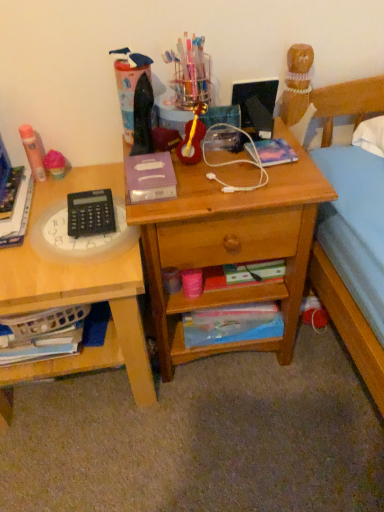
The height and width of the screenshot is (512, 384). What are the coordinates of `vacant area that lies to the right of matte orange glue stick at left, which is the 3th stationery from right to left` in the screenshot? It's located at (84, 175).